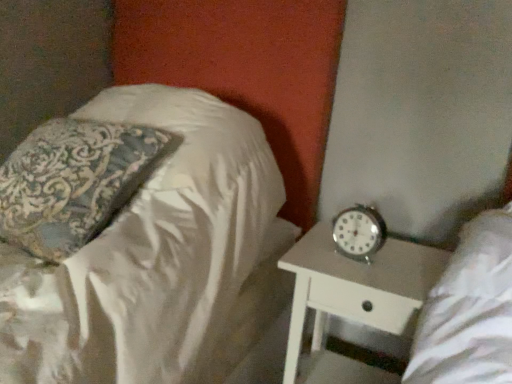
Question: From a real-world perspective, is metallic silver clock at right positioned over silky white pillow at upper left based on gravity?

Choices:
 (A) yes
 (B) no

Answer: (B)

Question: Does metallic silver clock at right have a lesser height compared to silky white pillow at upper left?

Choices:
 (A) yes
 (B) no

Answer: (A)

Question: Is silky white pillow at upper left completely or partially inside metallic silver clock at right?

Choices:
 (A) no
 (B) yes

Answer: (A)

Question: Is metallic silver clock at right behind silky white pillow at upper left?

Choices:
 (A) yes
 (B) no

Answer: (A)

Question: Considering the relative positions of metallic silver clock at right and silky white pillow at upper left in the image provided, is metallic silver clock at right to the left of silky white pillow at upper left from the viewer's perspective?

Choices:
 (A) no
 (B) yes

Answer: (A)

Question: Would you say metallic silver clock at right is a long distance from silky white pillow at upper left?

Choices:
 (A) yes
 (B) no

Answer: (B)

Question: Is white glossy nightstand at lower right shorter than metallic silver clock at right?

Choices:
 (A) yes
 (B) no

Answer: (B)

Question: Is white glossy nightstand at lower right positioned with its back to metallic silver clock at right?

Choices:
 (A) yes
 (B) no

Answer: (B)

Question: Would you say white glossy nightstand at lower right is outside metallic silver clock at right?

Choices:
 (A) no
 (B) yes

Answer: (B)

Question: Is metallic silver clock at right located within white glossy nightstand at lower right?

Choices:
 (A) no
 (B) yes

Answer: (A)

Question: Is white glossy nightstand at lower right wider than metallic silver clock at right?

Choices:
 (A) no
 (B) yes

Answer: (B)

Question: Does white glossy nightstand at lower right have a smaller size compared to metallic silver clock at right?

Choices:
 (A) yes
 (B) no

Answer: (B)

Question: Can you confirm if white glossy nightstand at lower right is positioned to the right of silky white pillow at upper left?

Choices:
 (A) no
 (B) yes

Answer: (B)